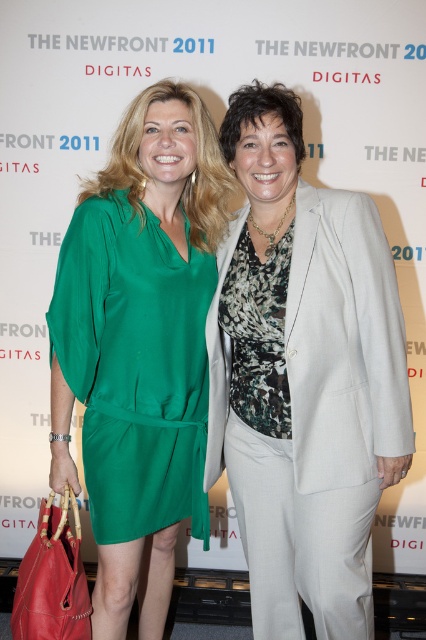
Question: Which point is farther to the camera?

Choices:
 (A) green silk dress at left
 (B) light gray wool business suit at center

Answer: (A)

Question: Does green silk dress at left have a larger size compared to light gray wool business suit at center?

Choices:
 (A) yes
 (B) no

Answer: (B)

Question: In this image, where is green silk dress at left located relative to light gray wool business suit at center?

Choices:
 (A) below
 (B) above

Answer: (A)

Question: Can you confirm if green silk dress at left is bigger than light gray wool business suit at center?

Choices:
 (A) yes
 (B) no

Answer: (B)

Question: Which point is farther to the camera?

Choices:
 (A) (77, 285)
 (B) (389, 365)

Answer: (A)